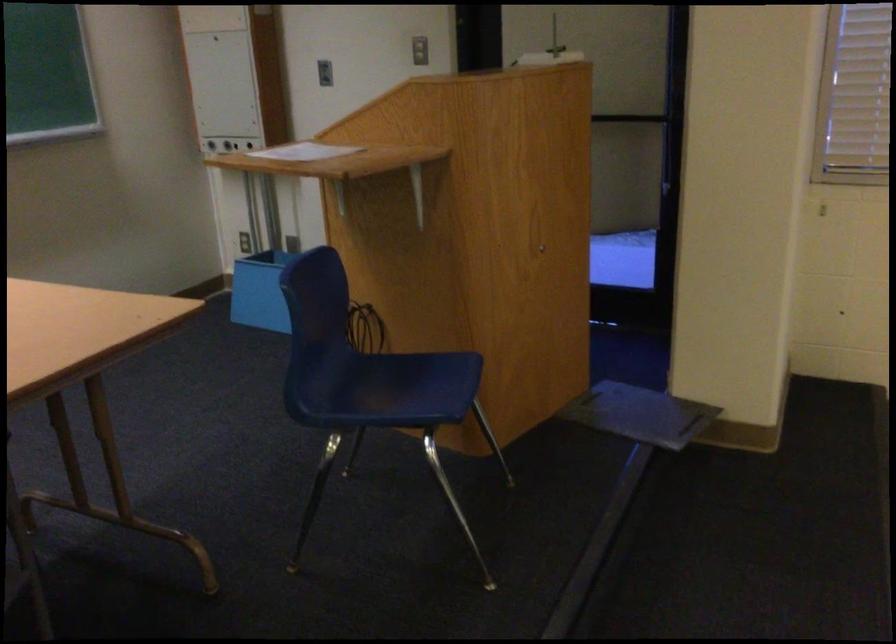
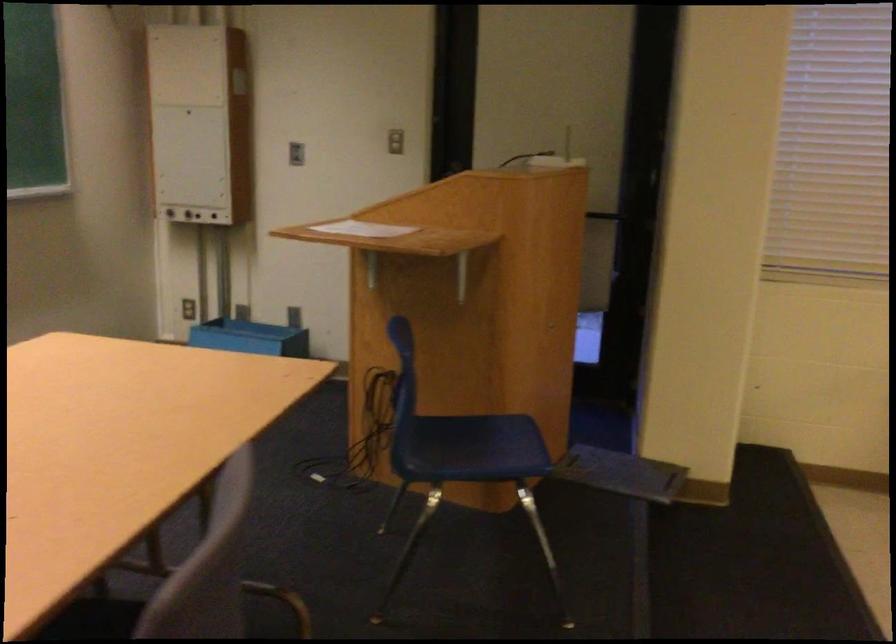
The point at (401, 383) is marked in the first image. Where is the corresponding point in the second image?

(466, 442)